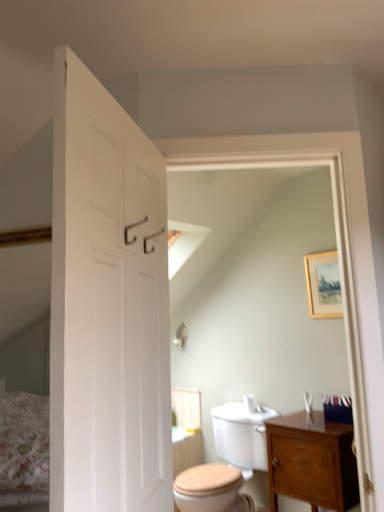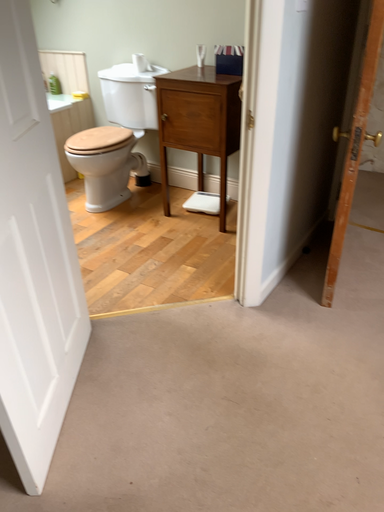
Question: Which way did the camera rotate in the video?

Choices:
 (A) rotated left
 (B) rotated right

Answer: (B)